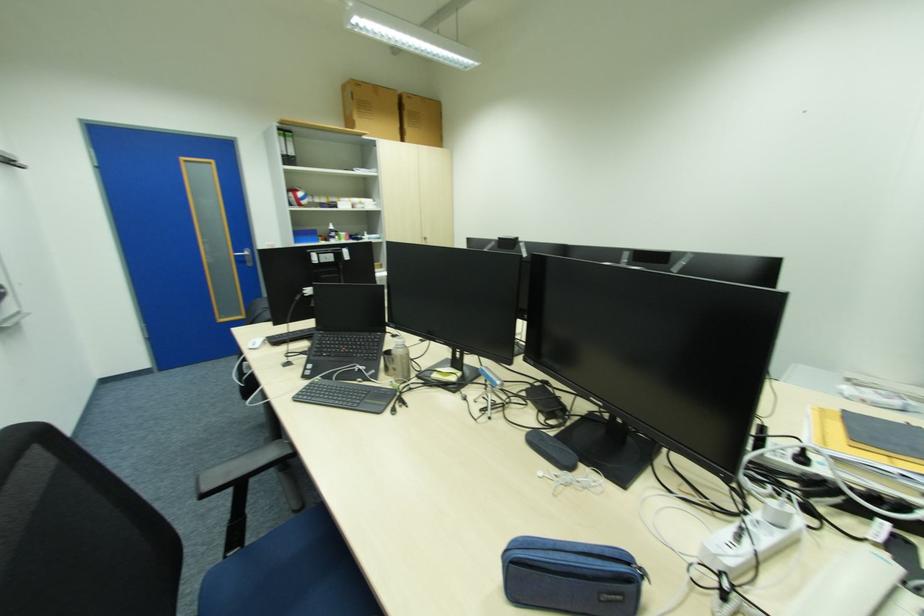
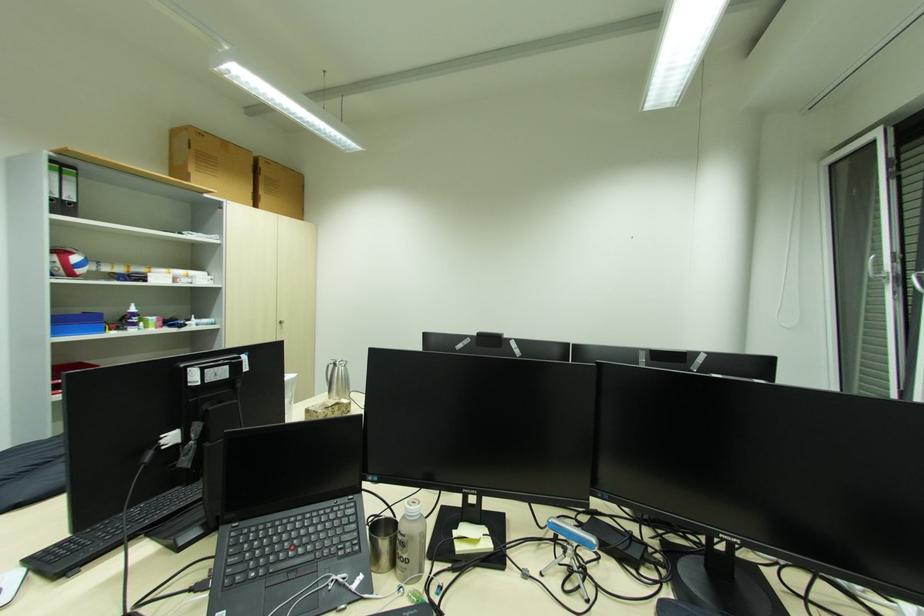
Question: The first image is from the beginning of the video and the second image is from the end. How did the camera likely rotate when shooting the video?

Choices:
 (A) Left
 (B) Right
 (C) Up
 (D) Down

Answer: (B)